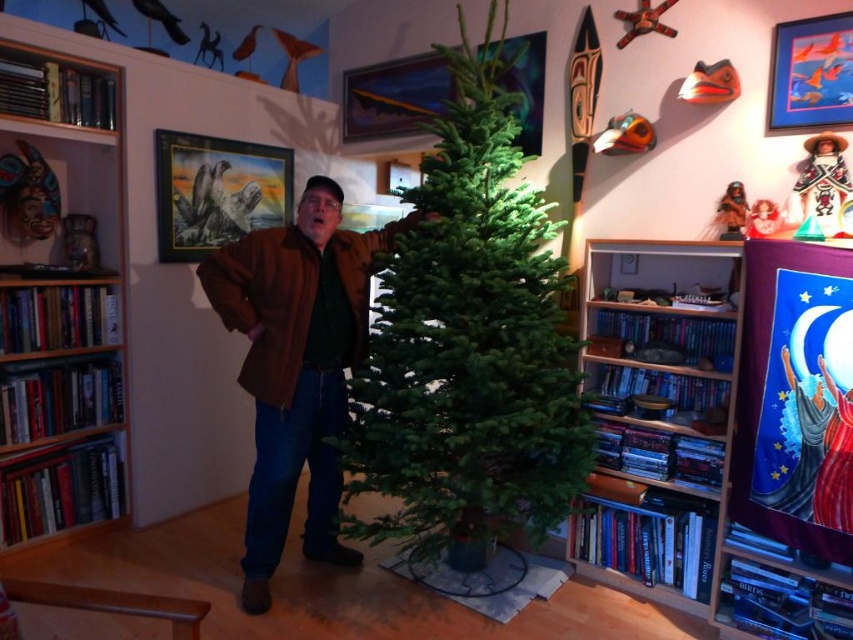
You are standing in the living room and want to place a 2.5 meter long garland on the green matte christmas tree at center. Considering your current position, will the garland be long enough to reach from the tree to the wall behind it?

The distance between the green matte christmas tree at center and the viewer is 2.28 meters. Since the garland is 2.5 meters long, it will be long enough to reach from the tree to the wall behind you.

You are organizing the living room and need to move the wooden bookshelf at left and the brown leather jacket at center to make space for a new sofa. Which object should you move first to free up more space?

You should move the brown leather jacket at center first because the wooden bookshelf at left occupies less space, meaning the jacket takes up more room and moving it first will free up more space.

You are a delivery person who needs to place a new 18 inch wide package between the green matte christmas tree at center and the wooden bookshelf at right. Can the package fit in the space between them?

The green matte christmas tree at center is 17.98 inches from the wooden bookshelf at right. Since the package is 18 inches wide, it cannot fit in the space between them as the distance is slightly less than the package width.